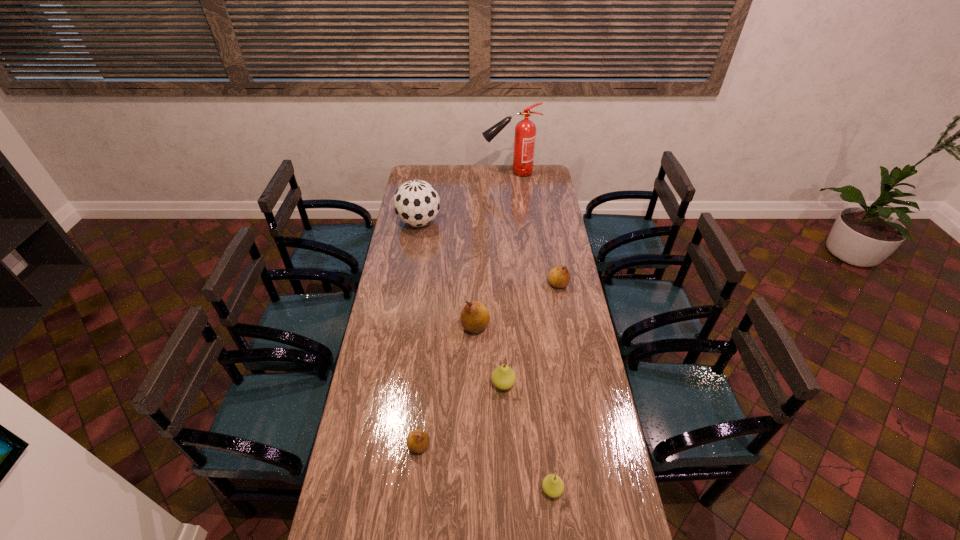
The image size is (960, 540). In order to click on vacant region between the nearest pear and the third tallest object in this screenshot , I will do `click(514, 408)`.

At what (x,y) coordinates should I click in order to perform the action: click on free spot between the second pear from left to right and the fire extinguisher. Please return your answer as a coordinate pair (x, y). Looking at the image, I should click on (492, 249).

I want to click on unoccupied position between the sixth nearest object and the farthest object, so click(x=465, y=197).

Locate an element on the screen. The width and height of the screenshot is (960, 540). free area in between the third pear from right to left and the red fire extinguisher is located at coordinates (507, 278).

You are a GUI agent. You are given a task and a screenshot of the screen. Output one action in this format:
    pyautogui.click(x=<x>, y=<y>)
    Task: Click on the vacant area that lies between the tallest object and the sixth shortest object
    
    Given the screenshot: What is the action you would take?
    pyautogui.click(x=465, y=197)

You are a GUI agent. You are given a task and a screenshot of the screen. Output one action in this format:
    pyautogui.click(x=<x>, y=<y>)
    Task: Click on the free space between the fifth shortest object and the right green pear
    The height and width of the screenshot is (540, 960).
    Given the screenshot: What is the action you would take?
    pyautogui.click(x=514, y=408)

Find the location of a particular element. empty space between the nearer green pear and the red fire extinguisher is located at coordinates (531, 331).

Where is `object that is the fifth closest one to the tallest object`? Image resolution: width=960 pixels, height=540 pixels. object that is the fifth closest one to the tallest object is located at coordinates (418, 441).

Select which object is the fourth closest to the second tallest object. Please provide its 2D coordinates. Your answer should be formatted as a tuple, i.e. [(x, y)], where the tuple contains the x and y coordinates of a point satisfying the conditions above.

[(503, 377)]

Point out which pear is positioned as the third nearest to the fire extinguisher. Please provide its 2D coordinates. Your answer should be formatted as a tuple, i.e. [(x, y)], where the tuple contains the x and y coordinates of a point satisfying the conditions above.

[(503, 377)]